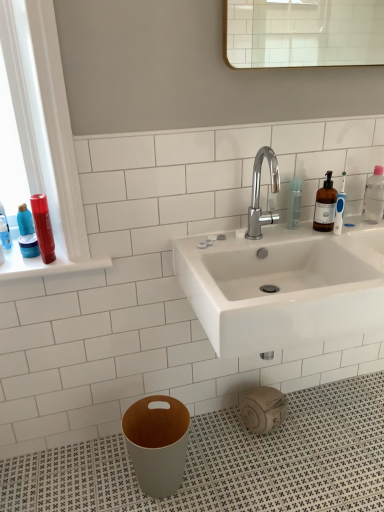
I want to click on spots to the right of chrome metallic faucet at center, so click(x=324, y=237).